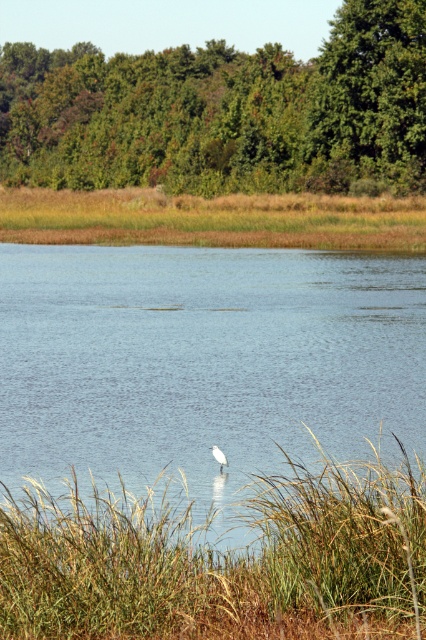
Which of these two, clear water at center or white matte bird at center, stands shorter?

white matte bird at center is shorter.

This screenshot has width=426, height=640. Describe the element at coordinates (204, 365) in the screenshot. I see `clear water at center` at that location.

Describe the element at coordinates (204, 365) in the screenshot. This screenshot has width=426, height=640. I see `clear water at center` at that location.

You are a GUI agent. You are given a task and a screenshot of the screen. Output one action in this format:
    pyautogui.click(x=<x>, y=<y>)
    Task: Click on the clear water at center
    The width and height of the screenshot is (426, 640).
    Given the screenshot: What is the action you would take?
    pyautogui.click(x=204, y=365)

Measure the distance between clear water at center and camera.

clear water at center and camera are 33.87 feet apart from each other.

Is clear water at center wider than green grass at center?

Yes, clear water at center is wider than green grass at center.

Between point (370, 275) and point (339, 561), which one is positioned in front?

Positioned in front is point (339, 561).

I want to click on clear water at center, so click(204, 365).

Is green leafy trees at upper center taller than white matte bird at center?

Yes, green leafy trees at upper center is taller than white matte bird at center.

Between point (270, 120) and point (218, 452), which one is positioned in front?

Point (218, 452) is in front.

The width and height of the screenshot is (426, 640). Identify the location of green leafy trees at upper center. (224, 112).

This screenshot has width=426, height=640. Identify the location of green leafy trees at upper center. (224, 112).